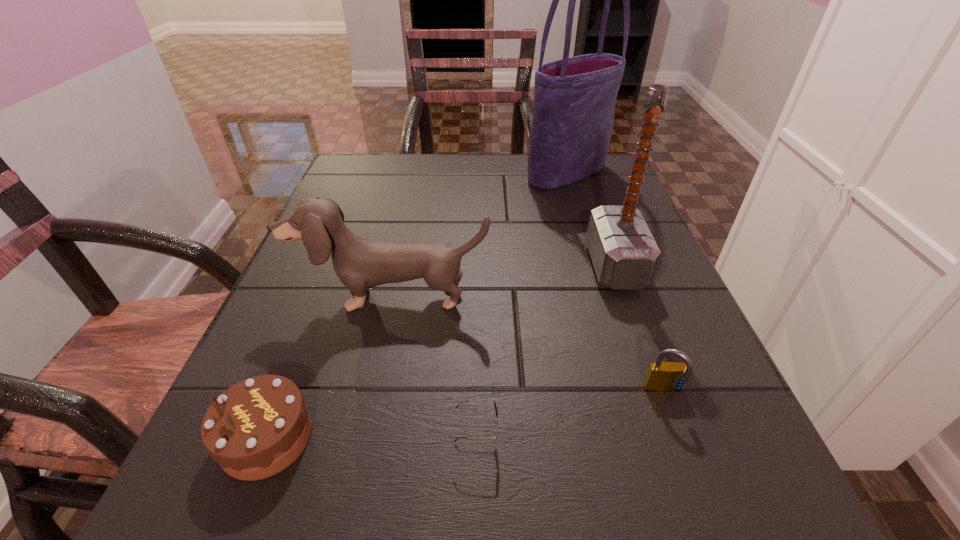
Where is `object that stands as the fifth closest to the tallest object`? object that stands as the fifth closest to the tallest object is located at coordinates (258, 427).

You are a GUI agent. You are given a task and a screenshot of the screen. Output one action in this format:
    pyautogui.click(x=<x>, y=<y>)
    Task: Click on the blank area in the image that satisfies the following two spatial constraints: 1. on the side with the combination dials of the padlock; 2. in front of the lenses of the sunglasses
    
    Given the screenshot: What is the action you would take?
    pyautogui.click(x=682, y=438)